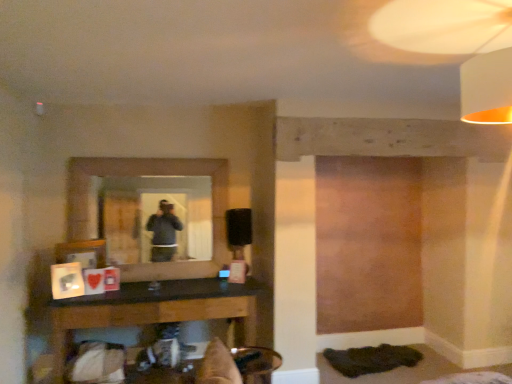
Question: Is metallic gold swivel chair at lower center facing away from black matte table lamp at center?

Choices:
 (A) no
 (B) yes

Answer: (A)

Question: Does metallic gold swivel chair at lower center lie in front of black matte table lamp at center?

Choices:
 (A) no
 (B) yes

Answer: (B)

Question: Does metallic gold swivel chair at lower center have a larger size compared to black matte table lamp at center?

Choices:
 (A) yes
 (B) no

Answer: (A)

Question: Is black matte table lamp at center surrounded by metallic gold swivel chair at lower center?

Choices:
 (A) yes
 (B) no

Answer: (B)

Question: From the image's perspective, is metallic gold swivel chair at lower center located beneath black matte table lamp at center?

Choices:
 (A) no
 (B) yes

Answer: (B)

Question: Is metallic gold swivel chair at lower center not inside black matte table lamp at center?

Choices:
 (A) no
 (B) yes

Answer: (B)

Question: Is black matte table lamp at center outside of black wood table at lower center?

Choices:
 (A) no
 (B) yes

Answer: (B)

Question: Is black matte table lamp at center thinner than black wood table at lower center?

Choices:
 (A) no
 (B) yes

Answer: (B)

Question: Does black matte table lamp at center have a larger size compared to black wood table at lower center?

Choices:
 (A) no
 (B) yes

Answer: (A)

Question: Is black matte table lamp at center aimed at black wood table at lower center?

Choices:
 (A) yes
 (B) no

Answer: (B)

Question: Is the position of black matte table lamp at center less distant than that of black wood table at lower center?

Choices:
 (A) yes
 (B) no

Answer: (B)

Question: Is black matte table lamp at center wider than black wood table at lower center?

Choices:
 (A) no
 (B) yes

Answer: (A)

Question: Is white fabric lampshade at upper right not near black wood table at lower center?

Choices:
 (A) yes
 (B) no

Answer: (A)